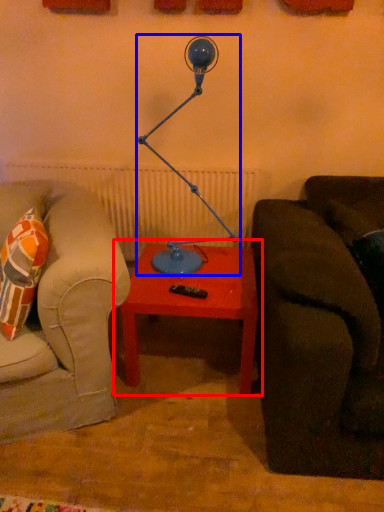
Question: Among these objects, which one is farthest to the camera, table (highlighted by a red box) or table lamp (highlighted by a blue box)?

Choices:
 (A) table
 (B) table lamp

Answer: (A)